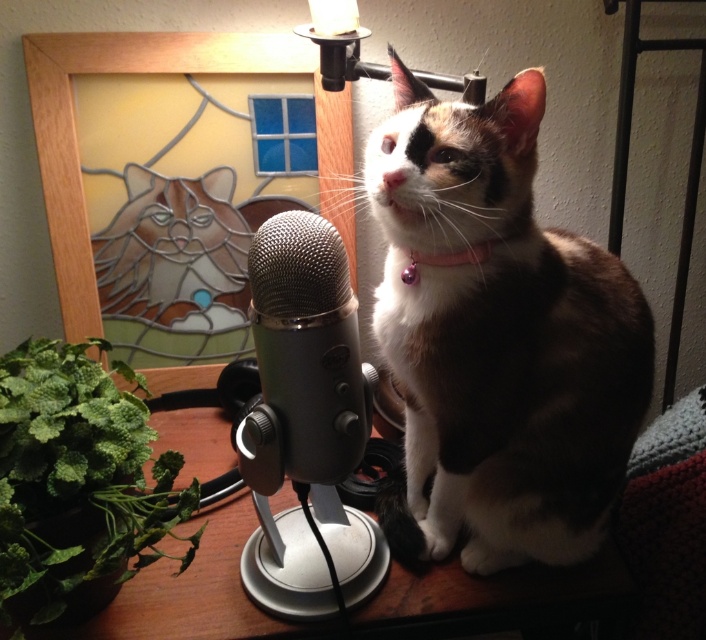
Question: Does calico fur cat at center have a larger size compared to green leafy plant at lower left?

Choices:
 (A) yes
 (B) no

Answer: (A)

Question: Does wooden table at center appear over satin silver microphone at center?

Choices:
 (A) no
 (B) yes

Answer: (A)

Question: Which object is closer to the camera taking this photo?

Choices:
 (A) satin silver microphone at center
 (B) calico fur cat at center
 (C) green leafy plant at lower left

Answer: (C)

Question: Does calico fur cat at center have a smaller size compared to wooden table at center?

Choices:
 (A) yes
 (B) no

Answer: (A)

Question: Which is farther from the satin silver microphone at center?

Choices:
 (A) calico fur cat at center
 (B) pink glossy collar at center

Answer: (A)

Question: Which of the following is the farthest from the observer?

Choices:
 (A) wooden table at center
 (B) calico fur cat at center

Answer: (A)